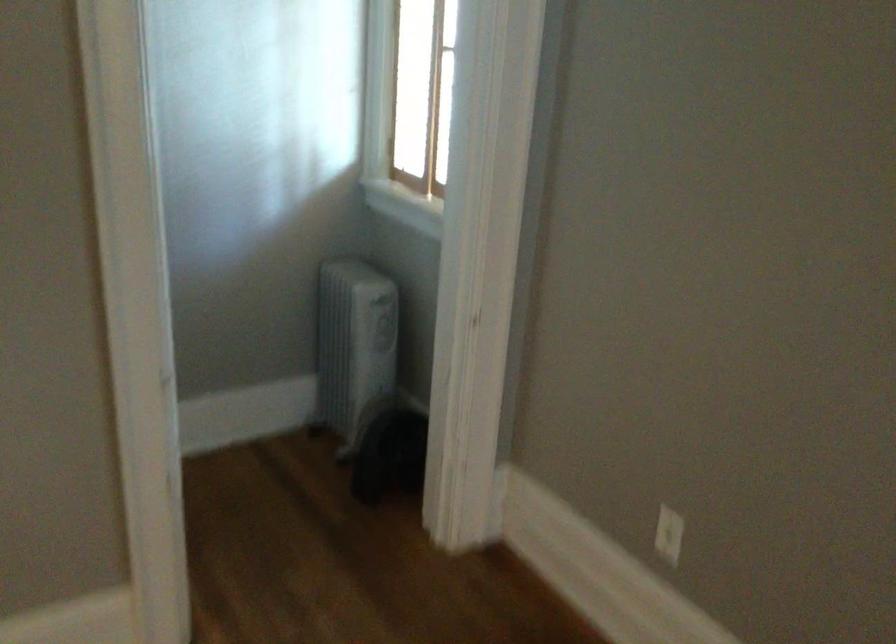
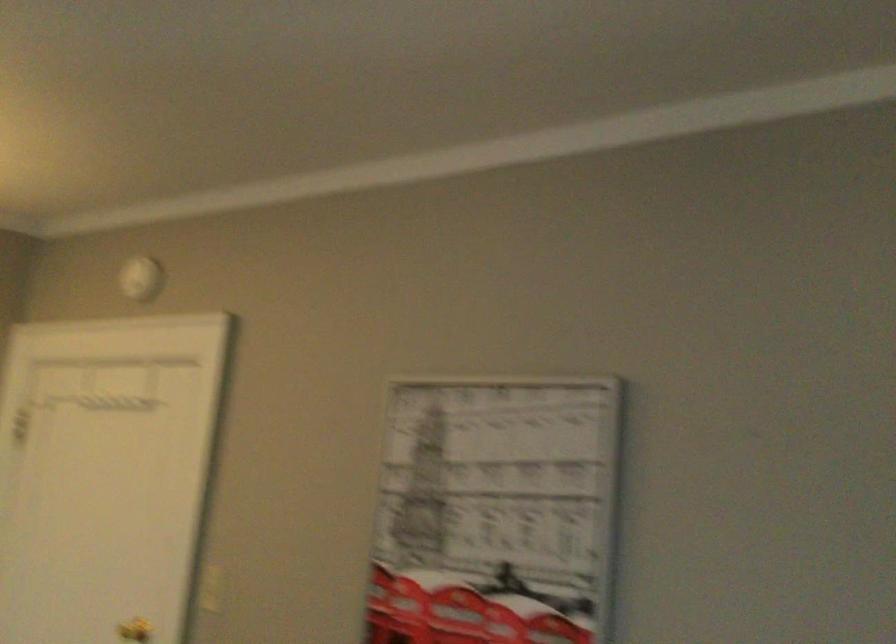
First-person continuous shooting, in which direction is the camera rotating?

The rotation direction of the camera is left-up.